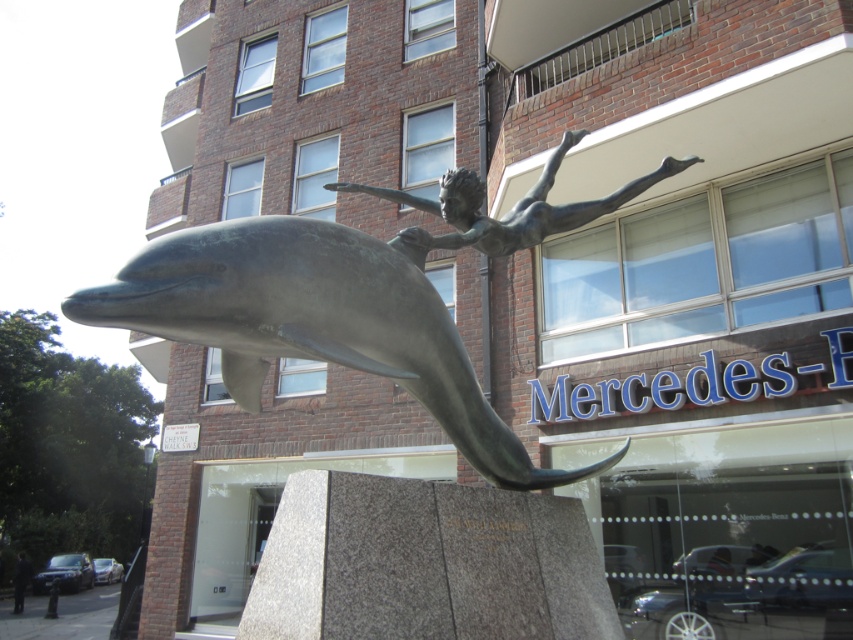
You are an art student analyzing the sculpture and its pedestal. You notice two bronze elements in the scene. Which one is taller, the bronze dolphin at center or the bronze statue at upper center?

The bronze dolphin at center is taller than the bronze statue at upper center.

You are an art student analyzing the sculpture. Based on the scene, where is the bronze dolphin at center in relation to the bronze statue at upper center?

The bronze dolphin at center is positioned below the bronze statue at upper center.